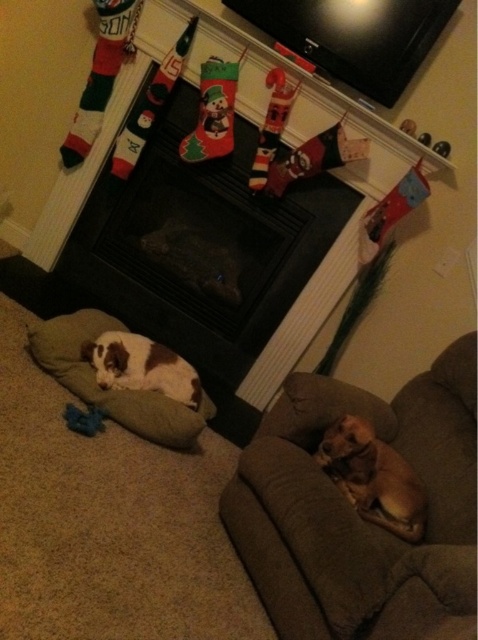
Which is more to the left, black matte fireplace at center or brown and white plush dog at lower left?

Positioned to the left is brown and white plush dog at lower left.

Can you confirm if black matte fireplace at center is shorter than brown and white plush dog at lower left?

No.

Is point (105, 200) less distant than point (139, 381)?

No.

Identify the location of black matte fireplace at center. (201, 244).

Who is shorter, green fabric dog bed at lower left or brown furry dog at lower right?

brown furry dog at lower right is shorter.

Can you confirm if green fabric dog bed at lower left is thinner than brown furry dog at lower right?

Incorrect, green fabric dog bed at lower left's width is not less than brown furry dog at lower right's.

Does point (72, 339) lie in front of point (355, 426)?

No, (72, 339) is behind (355, 426).

What are the coordinates of `green fabric dog bed at lower left` in the screenshot? It's located at (110, 390).

Does brown fabric couch at lower right have a larger size compared to brown and white plush dog at lower left?

Correct, brown fabric couch at lower right is larger in size than brown and white plush dog at lower left.

Can you confirm if brown fabric couch at lower right is positioned above brown and white plush dog at lower left?

Actually, brown fabric couch at lower right is below brown and white plush dog at lower left.

Identify the location of brown fabric couch at lower right. click(357, 515).